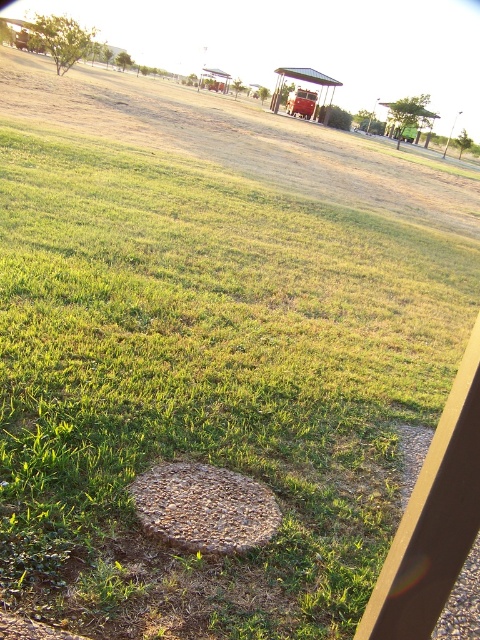
You are a delivery robot navigating the outdoor area. You see the granular concrete manhole at center and the metallic circular object at lower center. Which object is closer to your current position?

The metallic circular object at lower center is closer to your current position because it is positioned above the granular concrete manhole at center.

You are standing at the point labeled as point (204, 508) in the image. What object are you directly facing?

The point (204, 508) indicates the granular concrete manhole at center, so you are directly facing the granular concrete manhole at center.